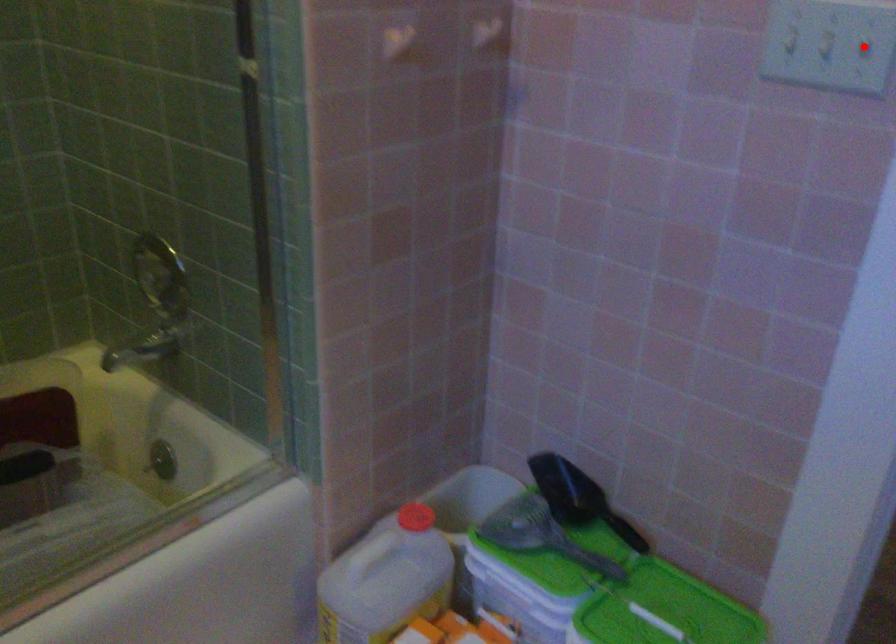
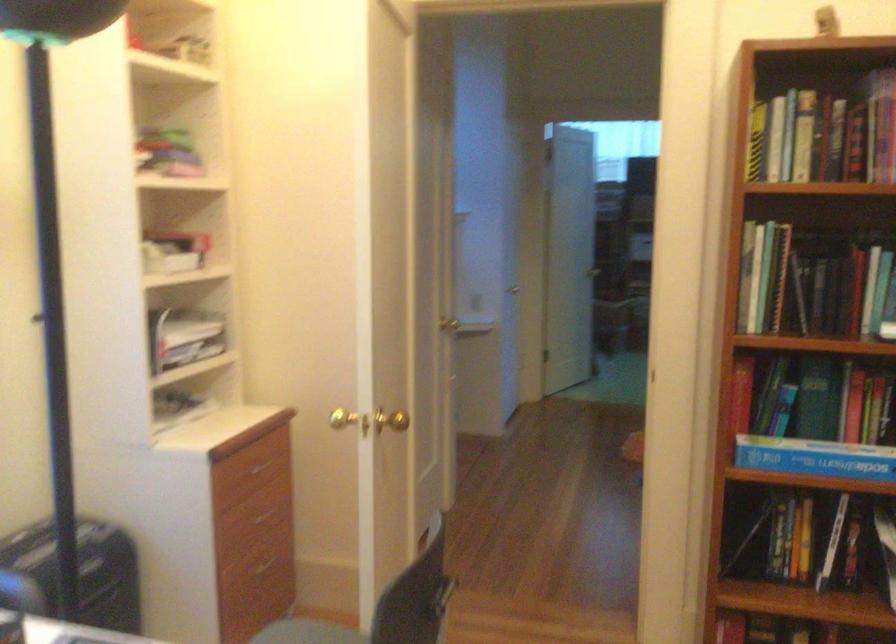
Question: I am providing you with two images of the same scene from different viewpoints. A red point is marked on the first image. At the location where the point appears in image 1, is it still visible in image 2?

Choices:
 (A) Yes
 (B) No

Answer: (B)